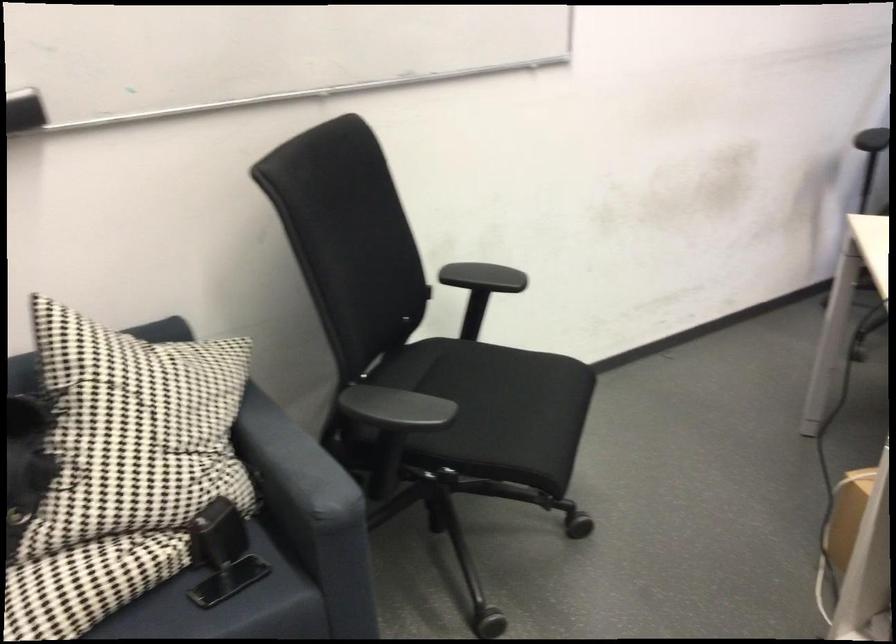
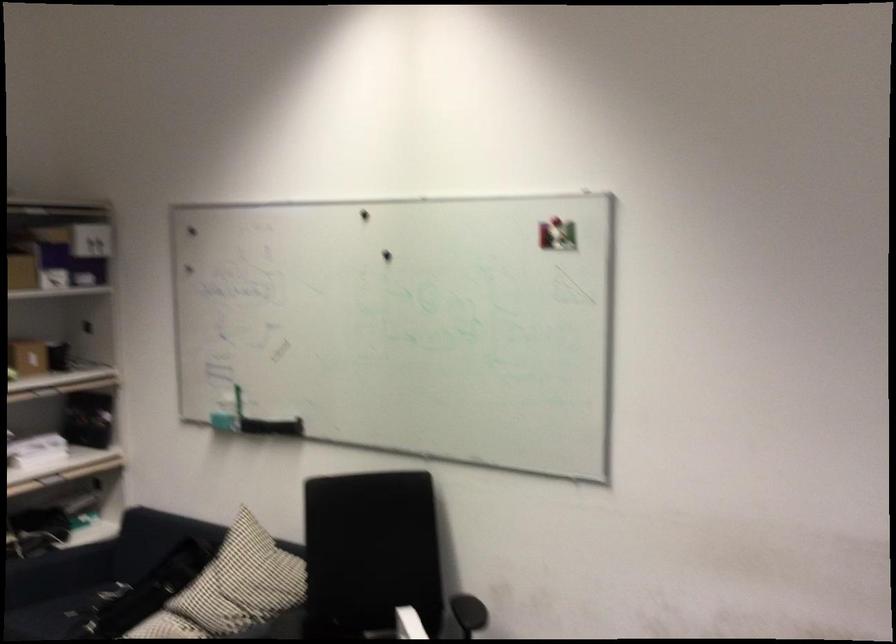
Where in the second image is the point corresponding to (x=152, y=431) from the first image?

(231, 588)